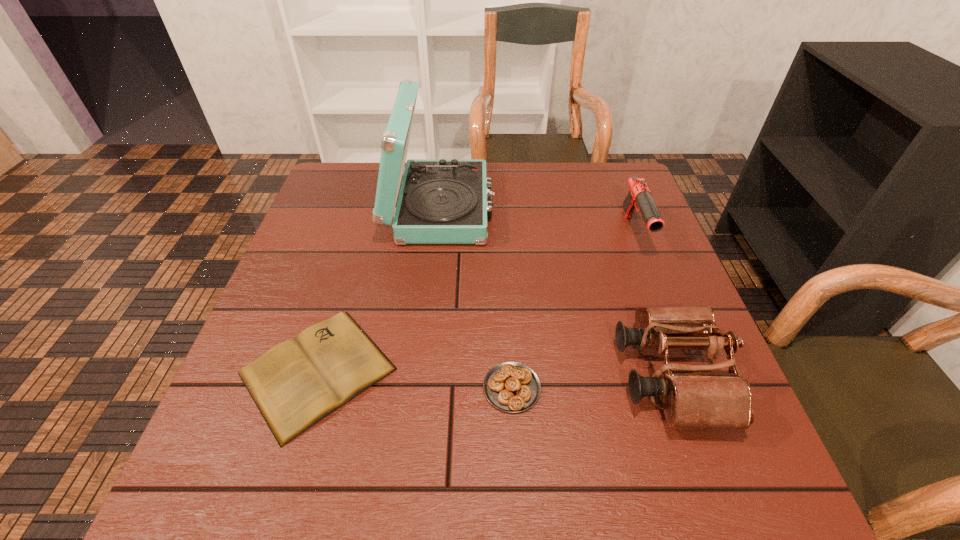
You are a GUI agent. You are given a task and a screenshot of the screen. Output one action in this format:
    pyautogui.click(x=<x>, y=<y>)
    Task: Click on the free space at the left edge of the desktop
    This screenshot has height=540, width=960.
    Given the screenshot: What is the action you would take?
    (x=214, y=444)

Where is `free space at the right edge`? free space at the right edge is located at coordinates (612, 259).

Where is `vacant point at the far right corner`? This screenshot has height=540, width=960. vacant point at the far right corner is located at coordinates (599, 195).

Image resolution: width=960 pixels, height=540 pixels. I want to click on vacant area at the near right corner, so click(x=727, y=467).

I want to click on free space between the record player and the shortest object, so click(379, 290).

Find the location of `vacant point located between the record player and the binoculars`. vacant point located between the record player and the binoculars is located at coordinates (555, 292).

Image resolution: width=960 pixels, height=540 pixels. Identify the location of vacant space that's between the gun and the second shortest object. (573, 310).

Identify the location of empty space that is in between the tallest object and the gun. (537, 220).

Locate an element on the screen. Image resolution: width=960 pixels, height=540 pixels. vacant area between the fourth tallest object and the shortest object is located at coordinates (415, 380).

This screenshot has width=960, height=540. Find the location of `free space between the binoculars and the pastry`. free space between the binoculars and the pastry is located at coordinates (590, 382).